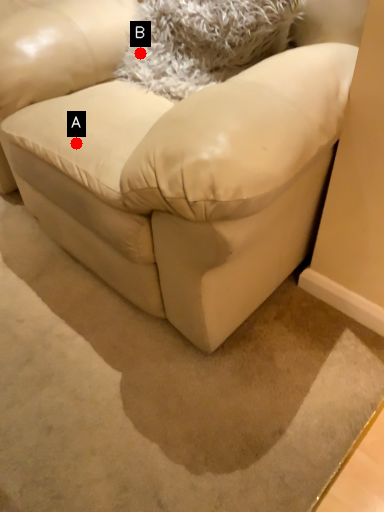
Question: Two points are circled on the image, labeled by A and B beside each circle. Which point is further to the camera?

Choices:
 (A) A is further
 (B) B is further

Answer: (B)